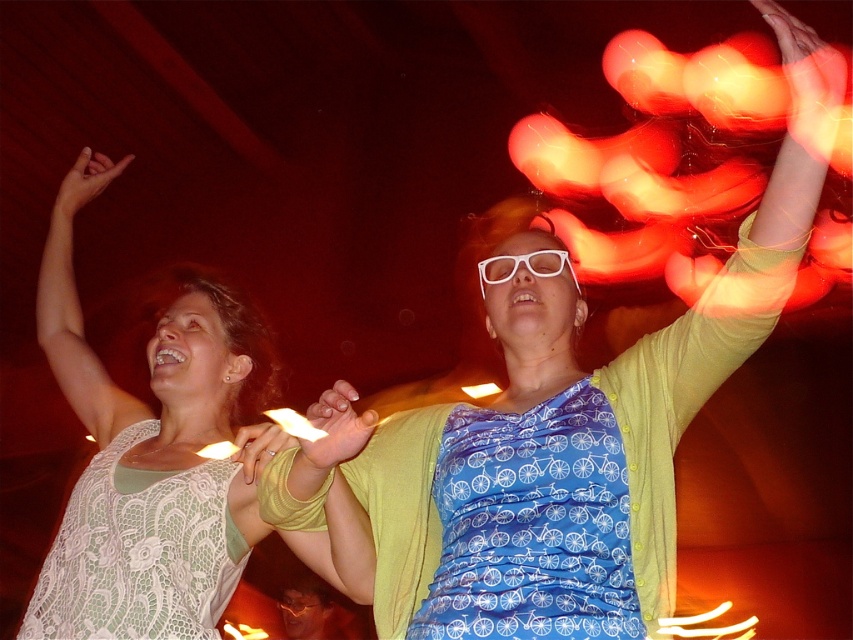
Who is taller, white lace arm at upper left or white plastic glasses at center?

white lace arm at upper left

Is point (61, 276) farther from camera compared to point (560, 272)?

Yes.

Describe the element at coordinates (78, 308) in the screenshot. I see `white lace arm at upper left` at that location.

Find the location of a particular element. Image resolution: width=853 pixels, height=640 pixels. white lace arm at upper left is located at coordinates (78, 308).

Who is taller, white lace dress at upper left or white lace arm at upper left?

With more height is white lace dress at upper left.

The image size is (853, 640). In order to click on white lace dress at upper left in this screenshot , I will do 148,468.

Who is positioned more to the left, smooth yellow hand at center or white plastic glasses at center?

From the viewer's perspective, smooth yellow hand at center appears more on the left side.

Find the location of a particular element. Image resolution: width=853 pixels, height=640 pixels. smooth yellow hand at center is located at coordinates (337, 426).

Image resolution: width=853 pixels, height=640 pixels. I want to click on smooth yellow hand at center, so click(337, 426).